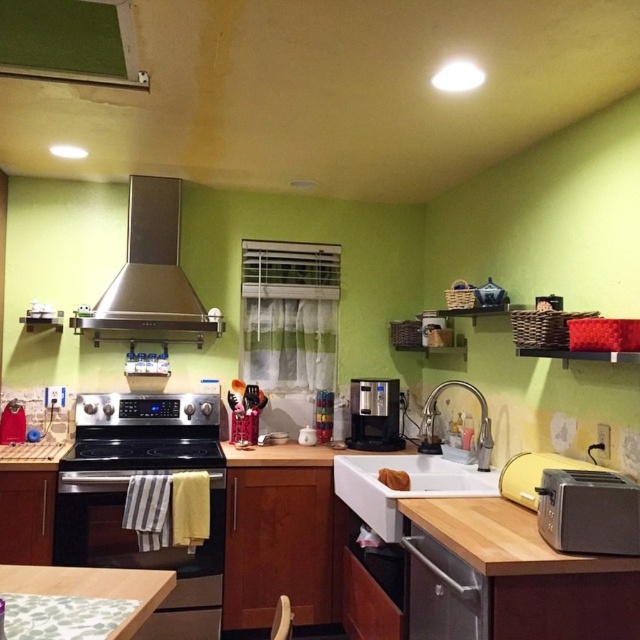
You are a kitchen designer and need to install a new microwave that requires a specific amount of space. The microwave must be placed either on the stainless steel exhaust hood at upper left or the wooden textured counter top at lower left. Based on their sizes, which object can accommodate the microwave?

The stainless steel exhaust hood at upper left is bigger than the wooden textured counter top at lower left, so the microwave can be placed on the stainless steel exhaust hood at upper left as it has sufficient space.

In the kitchen scene described, there is a white matte sink at center and a wooden textured counter top at lower left. Which object occupies a larger area in the image?

The white matte sink at center is bigger than the wooden textured counter top at lower left, so it occupies a larger area in the image.